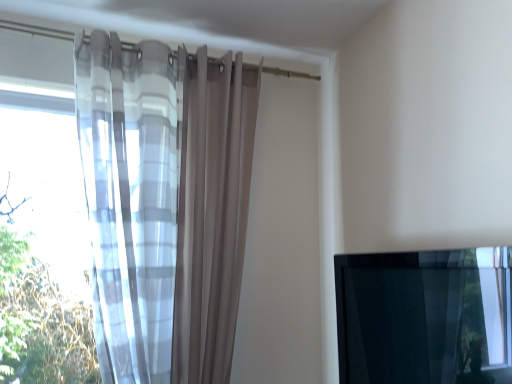
Question: Would you say transparent glass window at lower right is inside or outside translucent fabric curtain at left?

Choices:
 (A) outside
 (B) inside

Answer: (A)

Question: Is point (352, 364) positioned closer to the camera than point (148, 233)?

Choices:
 (A) farther
 (B) closer

Answer: (A)

Question: Is transparent glass window at lower right bigger or smaller than translucent fabric curtain at left?

Choices:
 (A) big
 (B) small

Answer: (B)

Question: Considering the positions of translucent fabric curtain at left and transparent glass window at lower right in the image, is translucent fabric curtain at left bigger or smaller than transparent glass window at lower right?

Choices:
 (A) small
 (B) big

Answer: (B)

Question: Is translucent fabric curtain at left inside or outside of transparent glass window at lower right?

Choices:
 (A) outside
 (B) inside

Answer: (A)

Question: Is point (188, 329) closer or farther from the camera than point (413, 360)?

Choices:
 (A) closer
 (B) farther

Answer: (A)

Question: From the image's perspective, relative to transparent glass window at lower right, is translucent fabric curtain at left above or below?

Choices:
 (A) below
 (B) above

Answer: (B)